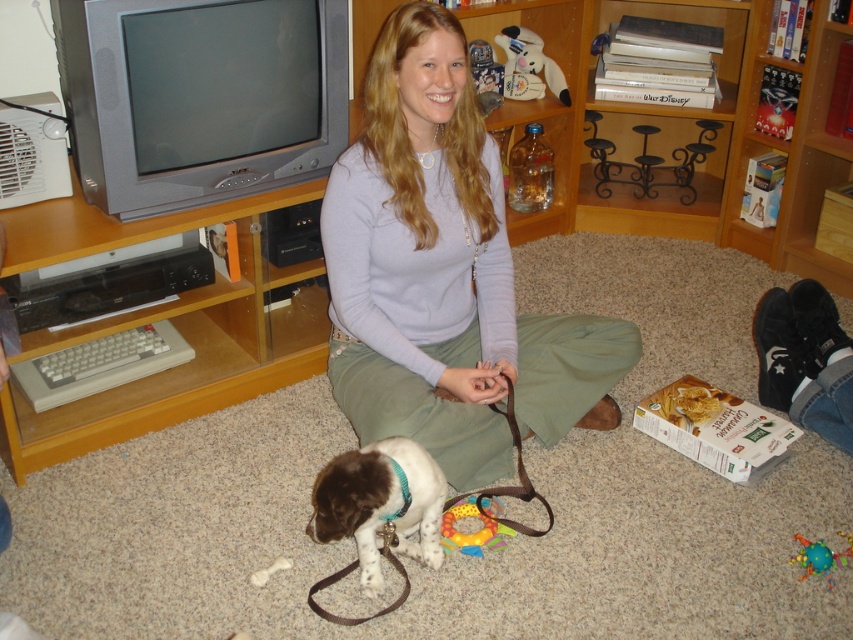
Based on the photo, you are a visitor in the room and want to place a small plant pot between the wooden bookshelf at upper center and the white fur at lower center. Is the vertical space between them sufficient to accommodate the plant pot?

The wooden bookshelf at upper center is above the white fur at lower center, so there is enough vertical space to place the plant pot between them.